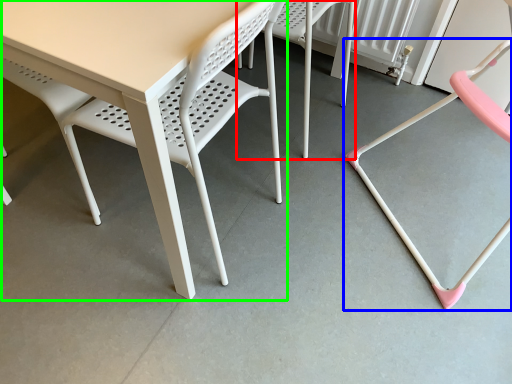
Question: Which object is positioned farthest from chair (highlighted by a red box)? Select from chair (highlighted by a blue box) and table (highlighted by a green box).

Choices:
 (A) chair
 (B) table

Answer: (B)